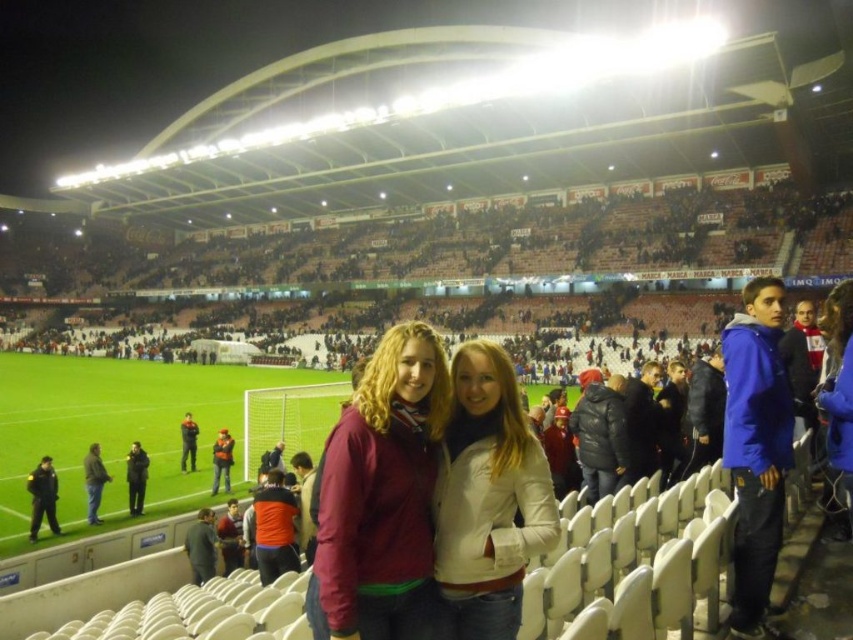
You are standing at the back of the stadium and want to take a photo of two specific points in the image. The first point is at coordinates point (395, 348) and the second is at point (476, 470). Since you want to ensure both are in focus, which point should you focus on to capture both clearly?

You should focus on point (476, 470) because it is farther from the camera than point (395, 348). By focusing on the farther point, the closer point will also be within the depth of field, ensuring both are in focus.

You are a photographer trying to capture a photo of both the maroon fabric jacket at center and the orange fabric jacket at lower center. Since you want to include both jackets in the frame, which jacket should you focus on to ensure both are visible?

To ensure both the maroon fabric jacket at center and the orange fabric jacket at lower center are visible, focus on the maroon fabric jacket at center since it is wider. This will allow the narrower orange fabric jacket at lower center to fit within the frame more easily.

You are a photographer at the stadium and want to capture both the maroon fabric jacket at center and the orange fabric jacket at lower center in a single shot. However, due to the camera settings, you can only focus on one layer at a time. Which jacket should you focus on to ensure the other is still visible in the background?

You should focus on the maroon fabric jacket at center because it is positioned over the orange fabric jacket at lower center, meaning the orange jacket will naturally appear in the background when the maroon jacket is in focus.